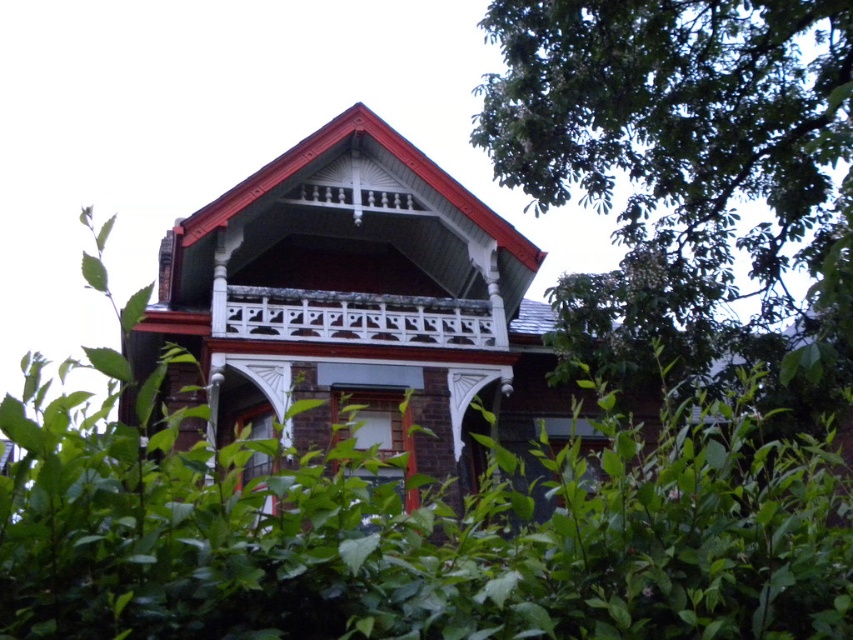
You are standing in front of the house and want to know how far the point at coordinates (672, 112) is from you. Can you determine the distance?

The point at coordinates (672, 112) is 184.28 feet away from the viewer.

You are standing in front of the house and notice the green leafy tree at upper right and the white painted wood balcony at upper center. Which object is positioned closer to you?

The green leafy tree at upper right is closer to the viewer than the white painted wood balcony at upper center.